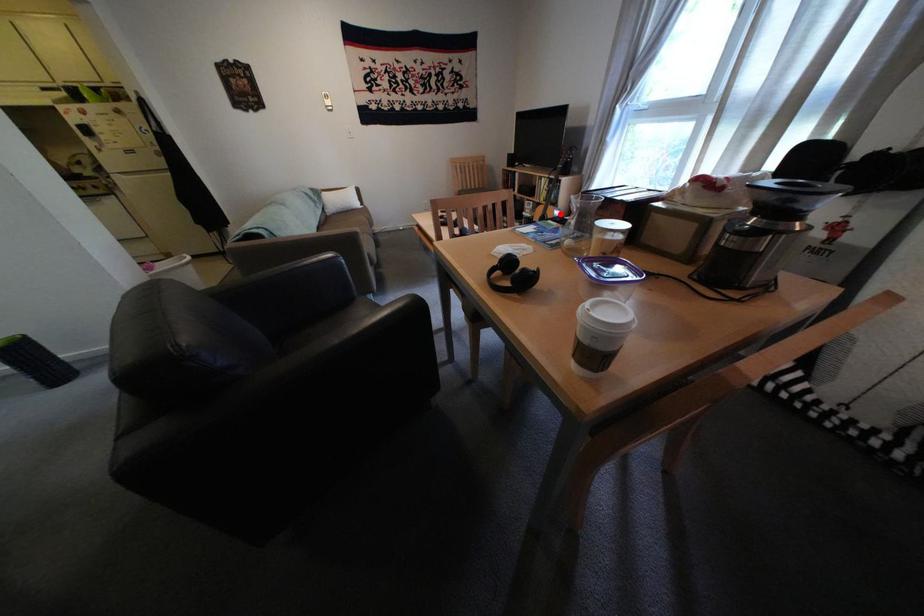
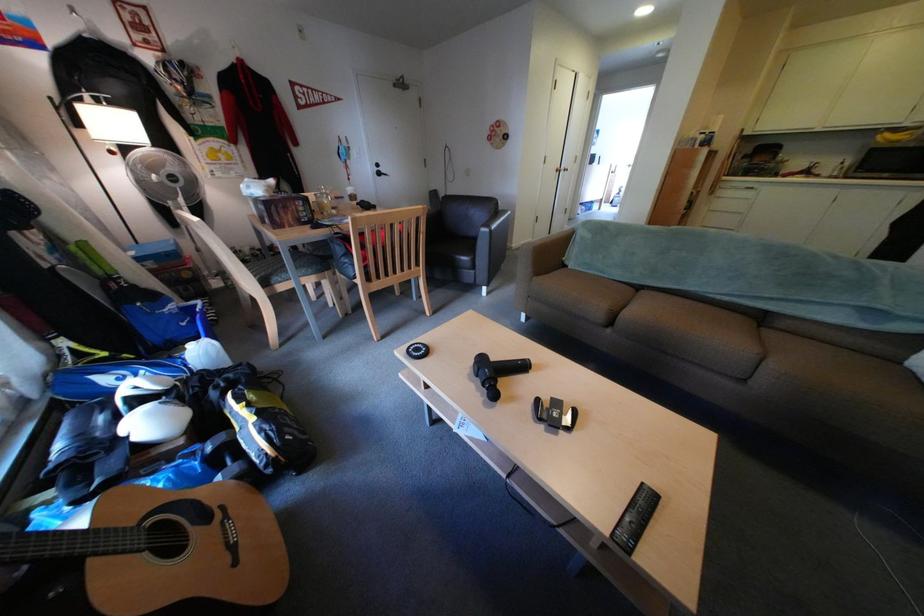
Where in the second image is the point corresponding to the highlighted location from the first image?

(148, 527)